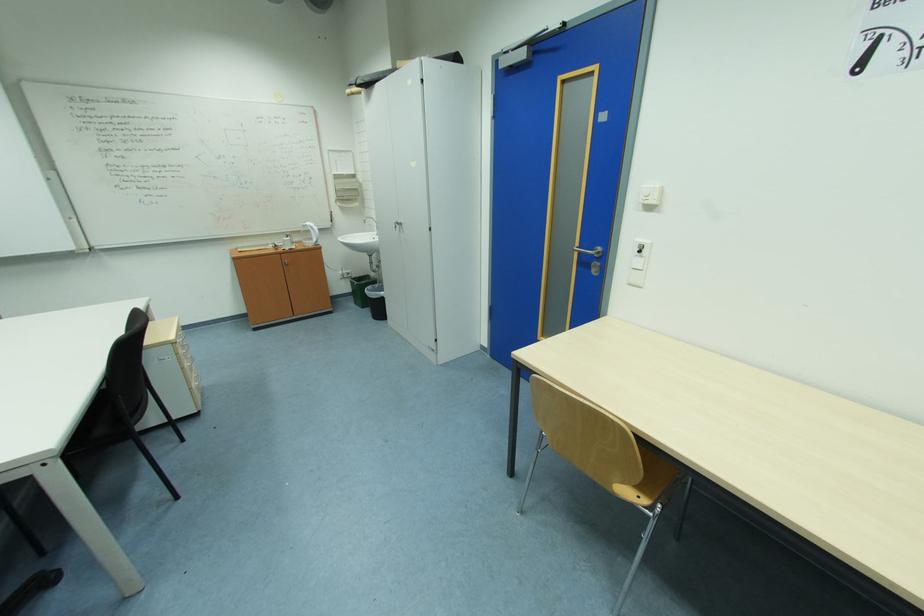
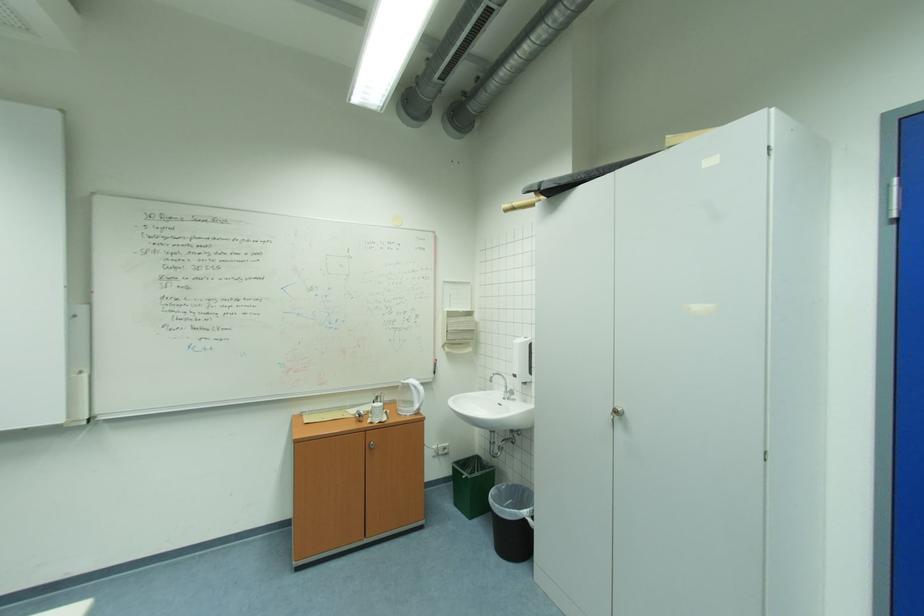
Locate, in the second image, the point that corresponds to point 390,294 in the first image.

(532, 513)